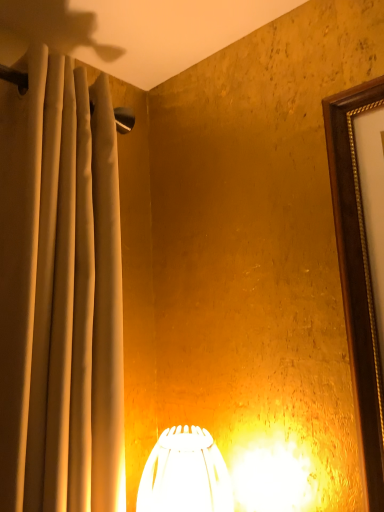
What do you see at coordinates (60, 294) in the screenshot? I see `beige fabric curtain at left` at bounding box center [60, 294].

This screenshot has width=384, height=512. What are the coordinates of `beige fabric curtain at left` in the screenshot? It's located at (60, 294).

Locate an element on the screen. The height and width of the screenshot is (512, 384). beige fabric curtain at left is located at coordinates (60, 294).